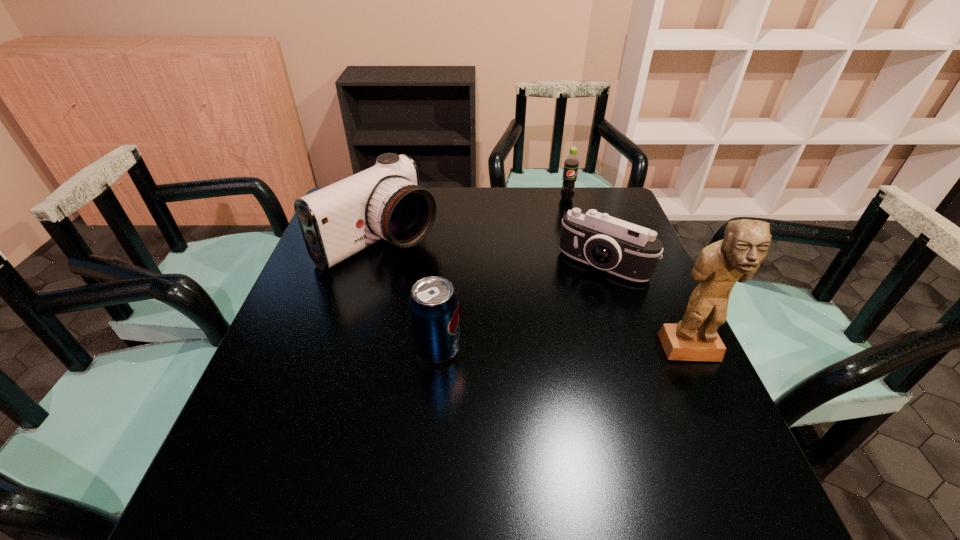
This screenshot has width=960, height=540. In order to click on figurine that is at the right edge in this screenshot , I will do `click(737, 257)`.

Locate an element on the screen. This screenshot has width=960, height=540. soda located in the right edge section of the desktop is located at coordinates (571, 163).

This screenshot has width=960, height=540. Identify the location of camera at the right edge. (630, 251).

The image size is (960, 540). I want to click on object that is at the far left corner, so click(386, 201).

Locate an element on the screen. The image size is (960, 540). object that is at the far right corner is located at coordinates (571, 163).

What are the coordinates of `vacant space at the far edge` in the screenshot? It's located at (475, 214).

In the image, there is a desktop. Identify the location of vacant space at the near edge. (424, 418).

Where is `vacant region at the left edge of the desktop`? This screenshot has height=540, width=960. vacant region at the left edge of the desktop is located at coordinates (289, 350).

This screenshot has height=540, width=960. I want to click on vacant space at the right edge of the desktop, so click(x=647, y=331).

You are a GUI agent. You are given a task and a screenshot of the screen. Output one action in this format:
    pyautogui.click(x=<x>, y=<y>)
    Task: Click on the free space at the near left corner of the desktop
    The height and width of the screenshot is (540, 960).
    Given the screenshot: What is the action you would take?
    pyautogui.click(x=299, y=417)